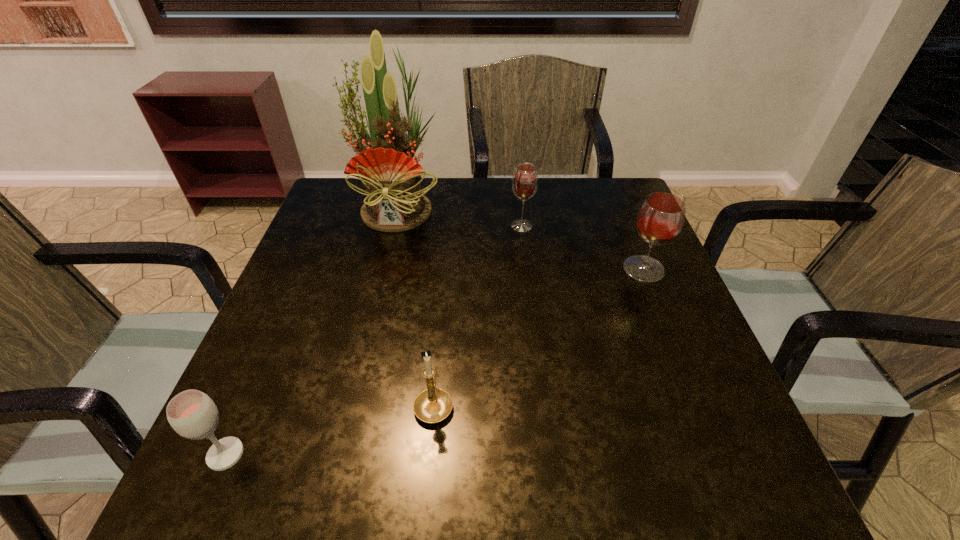
What are the coordinates of `object that ranks as the closest to the leftmost wineglass` in the screenshot? It's located at (432, 405).

Locate an element on the screen. This screenshot has width=960, height=540. the second closest wineglass to the rightmost object is located at coordinates (192, 414).

Identify which wineglass is the closest to the second object from right to left. Please provide its 2D coordinates. Your answer should be formatted as a tuple, i.e. [(x, y)], where the tuple contains the x and y coordinates of a point satisfying the conditions above.

[(661, 216)]

Where is `vacant space that satisfies the following two spatial constraints: 1. in front of the flower arrangement with the fan visible; 2. on the left side of the third farthest object`? vacant space that satisfies the following two spatial constraints: 1. in front of the flower arrangement with the fan visible; 2. on the left side of the third farthest object is located at coordinates (385, 269).